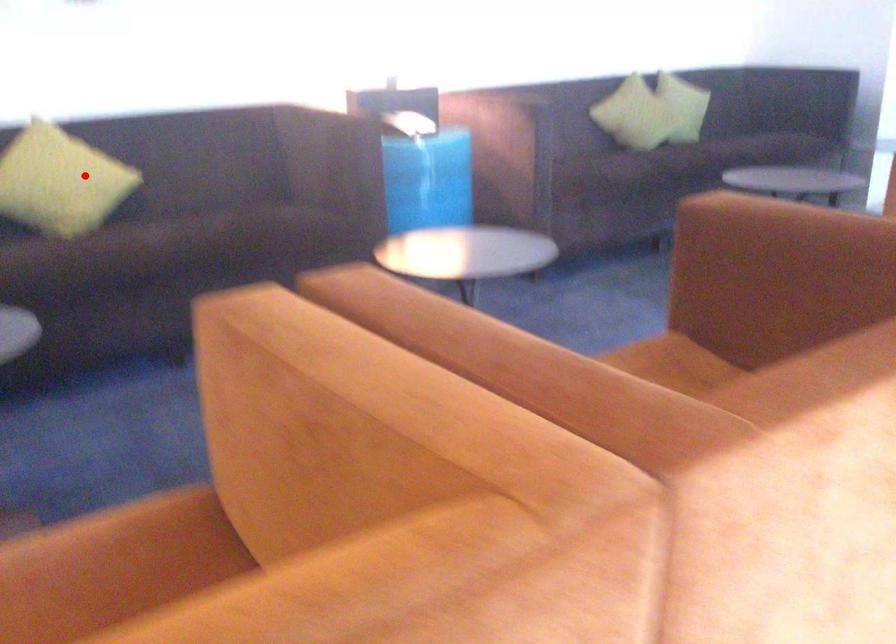
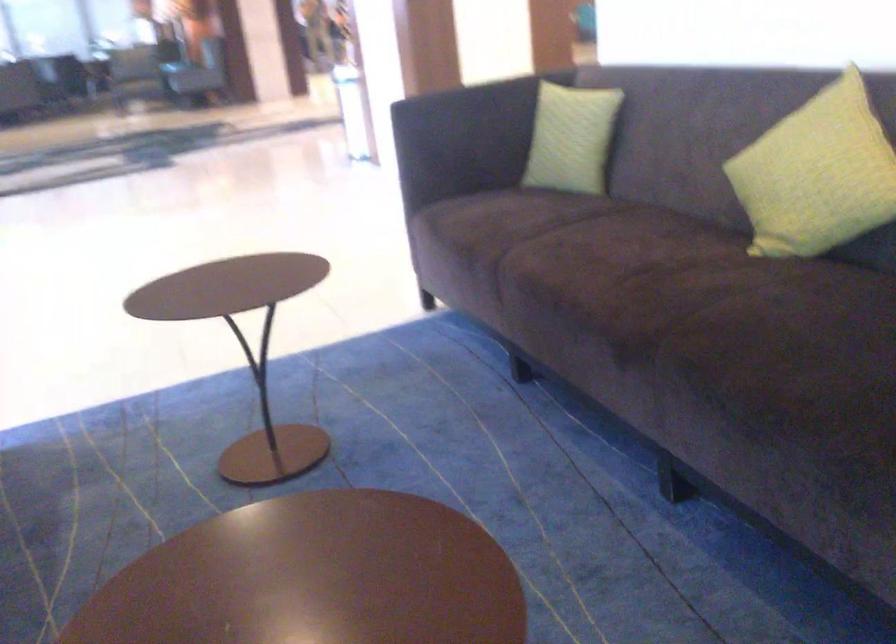
The point at the highlighted location is marked in the first image. Where is the corresponding point in the second image?

(816, 174)